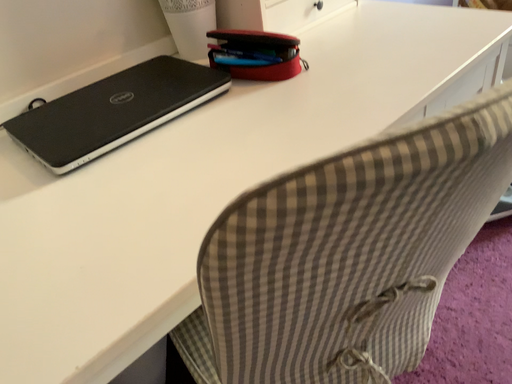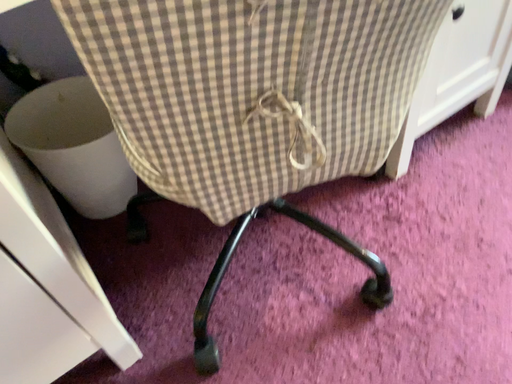
Question: Which way did the camera rotate in the video?

Choices:
 (A) rotated left
 (B) rotated right

Answer: (A)